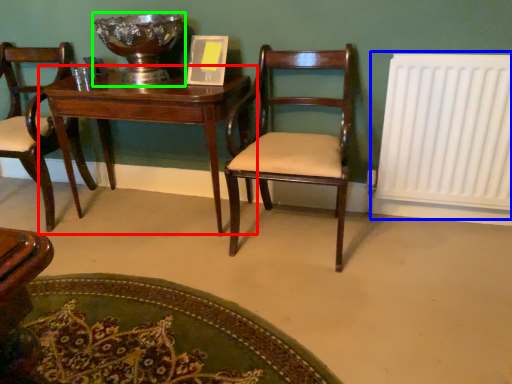
Question: Which is farther away from table (highlighted by a red box)? radiator (highlighted by a blue box) or glass bowl (highlighted by a green box)?

Choices:
 (A) radiator
 (B) glass bowl

Answer: (A)